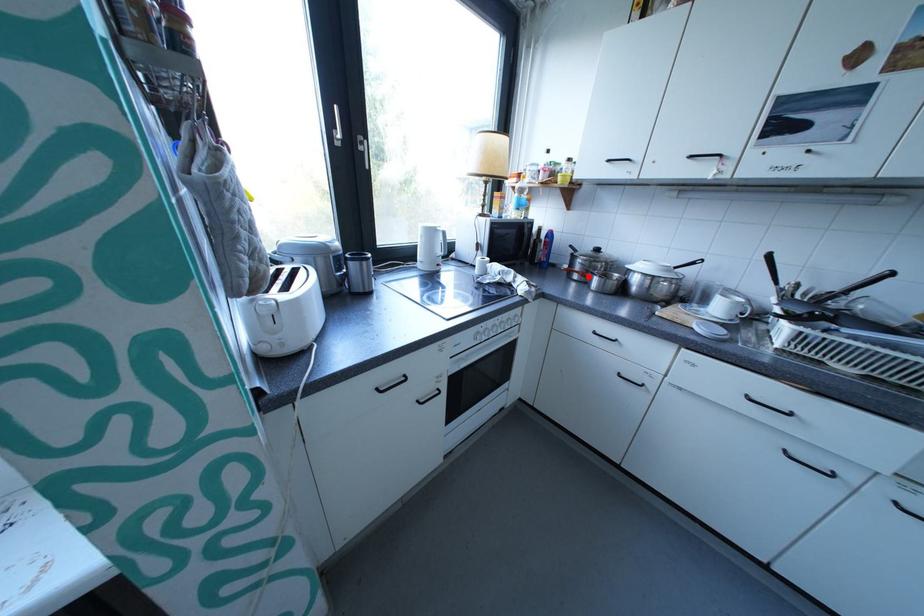
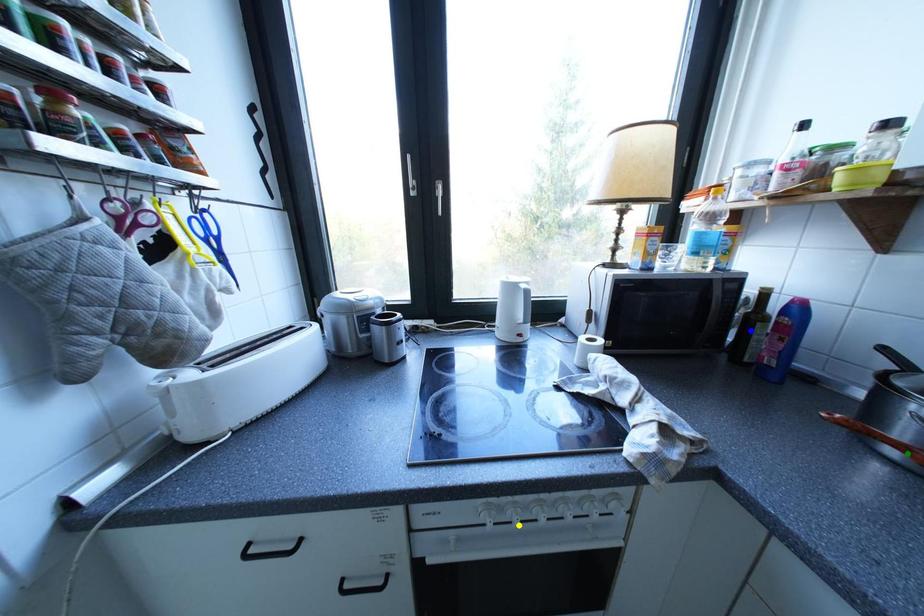
Question: I am providing you with two images of the same scene from different viewpoints. A red point is marked on the first image. You are given multiple points on the second image. Can you choose the point in image 2 that corresponds to the point in image 1?

Choices:
 (A) green point
 (B) blue point
 (C) yellow point

Answer: (A)